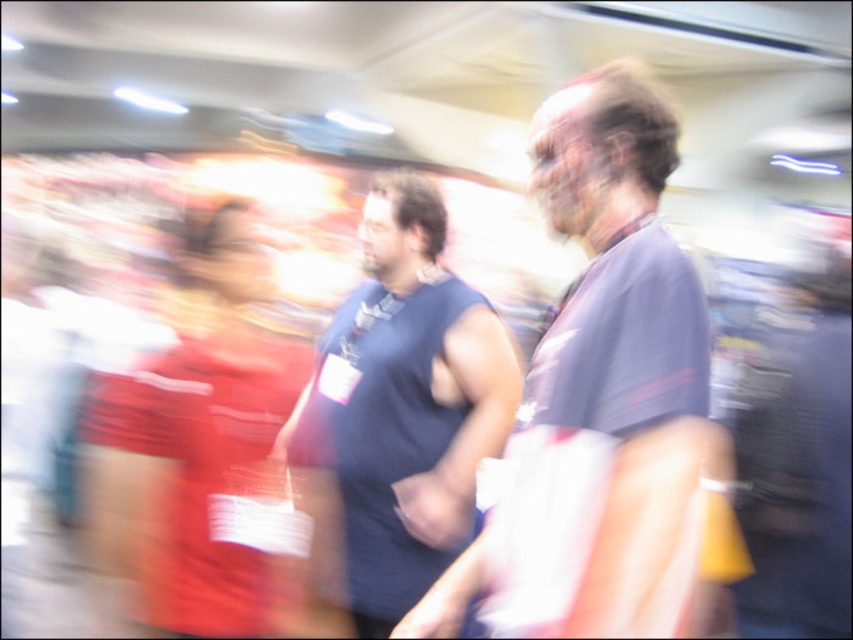
You are organizing a charity event and need to arrange seating for two guests wearing the dark blue sleeveless shirt at center and the matte red dress at left. Which guest should you seat first to accommodate their clothing width?

The dark blue sleeveless shirt at center is thinner than the matte red dress at left, so you should seat the guest wearing the matte red dress at left first to ensure there is enough space for their wider garment.